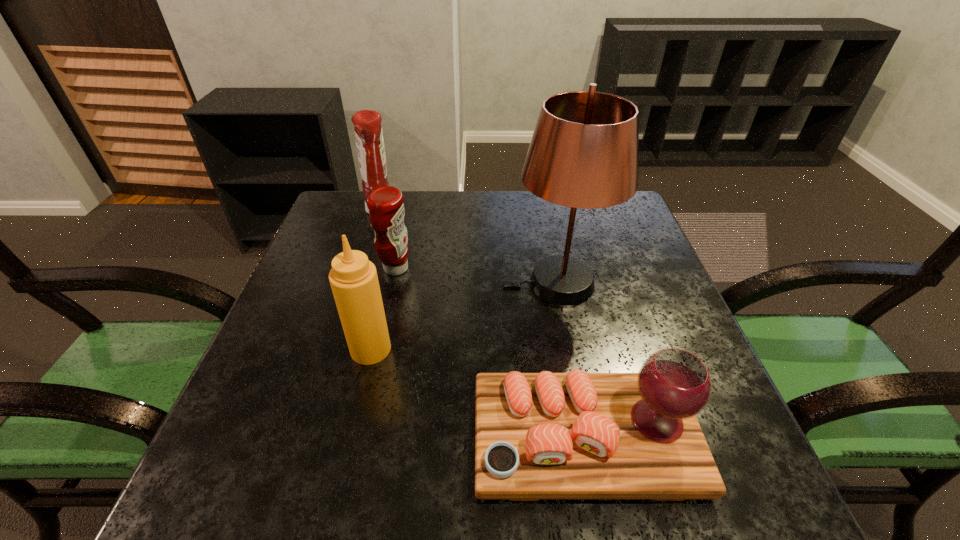
I want to click on lampshade, so click(584, 153).

Locate an element on the screen. the farthest object is located at coordinates (368, 131).

Find the location of a particular element. The height and width of the screenshot is (540, 960). the second nearest object is located at coordinates (353, 278).

Image resolution: width=960 pixels, height=540 pixels. What are the coordinates of `the shortest condiment` in the screenshot? It's located at (386, 208).

You are a GUI agent. You are given a task and a screenshot of the screen. Output one action in this format:
    pyautogui.click(x=<x>, y=<y>)
    Task: Click on the platter
    This screenshot has height=540, width=960.
    Given the screenshot: What is the action you would take?
    pyautogui.click(x=576, y=435)

The width and height of the screenshot is (960, 540). I want to click on vacant space situated on the front-facing side of the tallest object, so click(482, 283).

The width and height of the screenshot is (960, 540). Identify the location of free region located on the front-facing side of the tallest object. (398, 283).

I want to click on free spot located 0.260m on the front-facing side of the tallest object, so click(395, 283).

Find the location of `free space located 0.080m on the left of the farthest object`. free space located 0.080m on the left of the farthest object is located at coordinates (339, 210).

Identify the location of vacant region located 0.370m on the right of the nearest condiment. The image size is (960, 540). (571, 349).